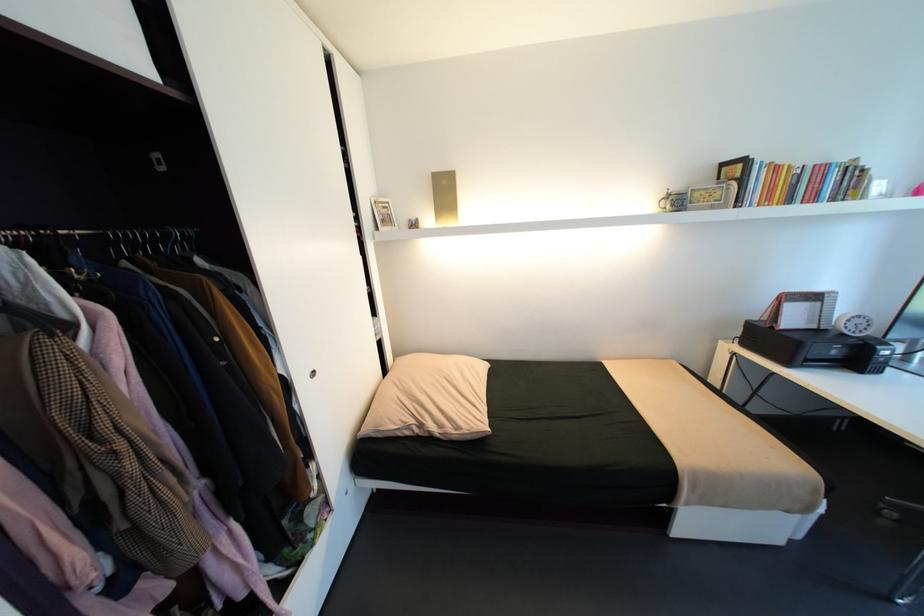
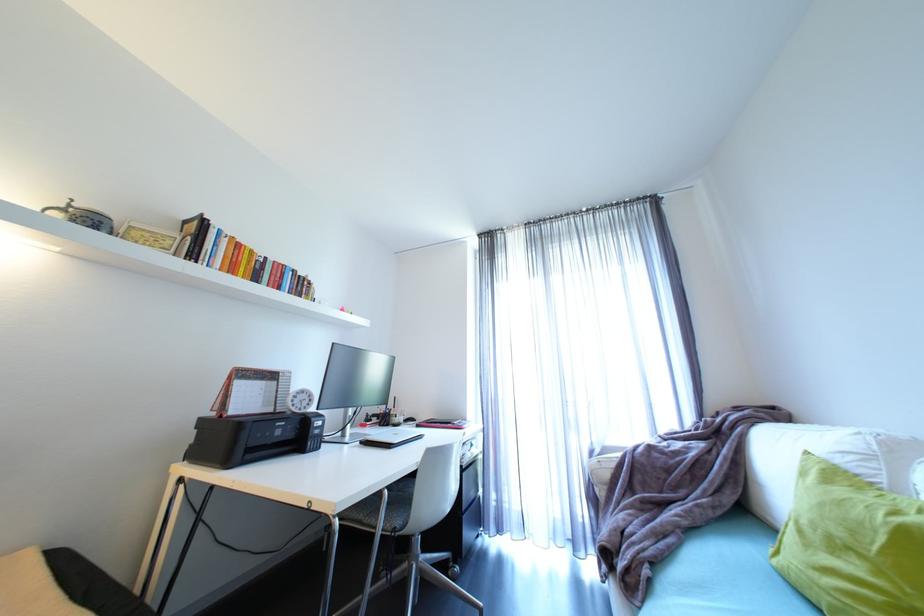
The point at (x=779, y=328) is marked in the first image. Where is the corresponding point in the second image?

(228, 416)